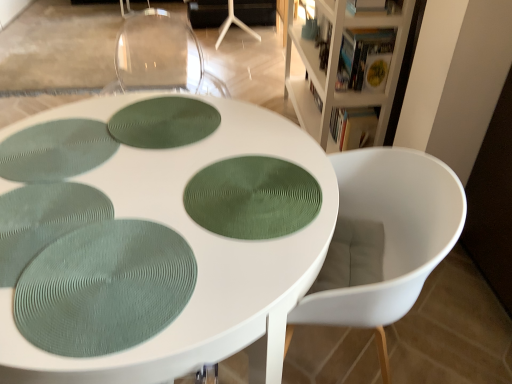
The image size is (512, 384). What are the coordinates of `vacant area on top of green textured placemat at center, which is the 1th oval in back-to-front order (from a real-world perspective)` in the screenshot? It's located at (168, 115).